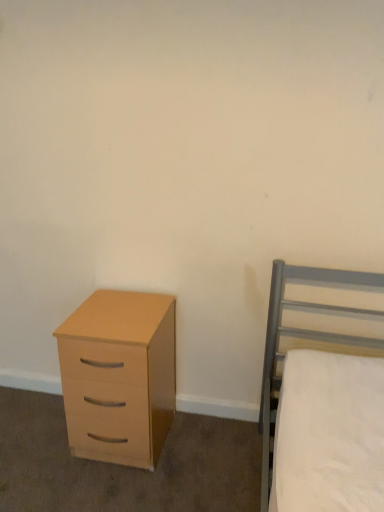
I want to click on free location above light wood/veneer chest of drawers at lower left (from a real-world perspective), so click(133, 301).